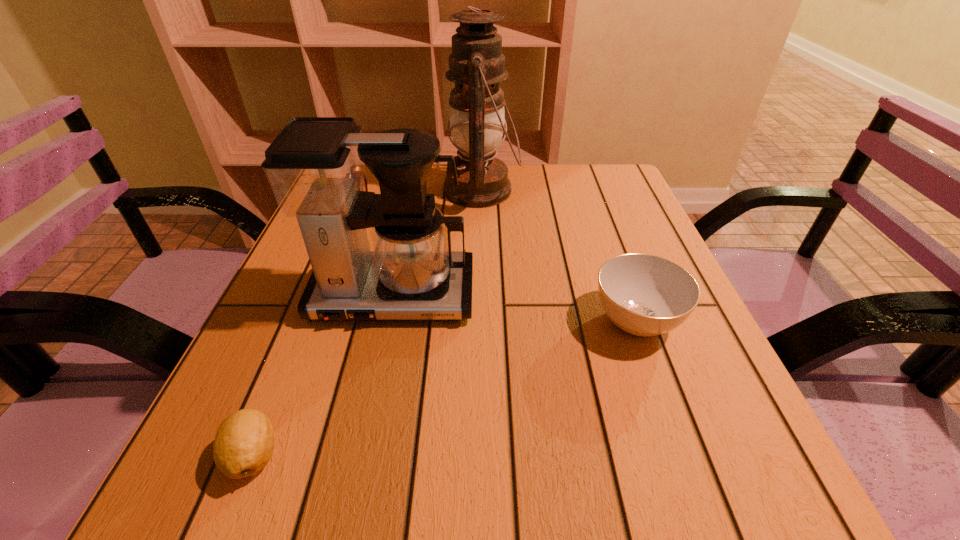
Where is `free region located on the left of the chinaware`? The image size is (960, 540). free region located on the left of the chinaware is located at coordinates (397, 321).

Identify the location of lantern at the far edge. (476, 65).

The image size is (960, 540). I want to click on alarm clock present at the far edge, so click(x=364, y=187).

This screenshot has width=960, height=540. In order to click on object present at the near edge in this screenshot , I will do `click(244, 443)`.

Where is `coffee maker that is at the left edge`? coffee maker that is at the left edge is located at coordinates coord(316,166).

You are a GUI agent. You are given a task and a screenshot of the screen. Output one action in this format:
    pyautogui.click(x=<x>, y=<y>)
    Task: Click on the alarm clock that is at the left edge
    The width and height of the screenshot is (960, 540).
    Given the screenshot: What is the action you would take?
    pyautogui.click(x=364, y=187)

Where is `lemon that is at the left edge`? The height and width of the screenshot is (540, 960). lemon that is at the left edge is located at coordinates (244, 443).

You are a GUI agent. You are given a task and a screenshot of the screen. Output one action in this format:
    pyautogui.click(x=<x>, y=<y>)
    Task: Click on the object that is positioned at the right edge
    This screenshot has height=540, width=960.
    Given the screenshot: What is the action you would take?
    pyautogui.click(x=645, y=295)

The height and width of the screenshot is (540, 960). I want to click on object present at the far left corner, so click(x=364, y=187).

This screenshot has height=540, width=960. Find the location of `object at the near left corner`. object at the near left corner is located at coordinates (244, 443).